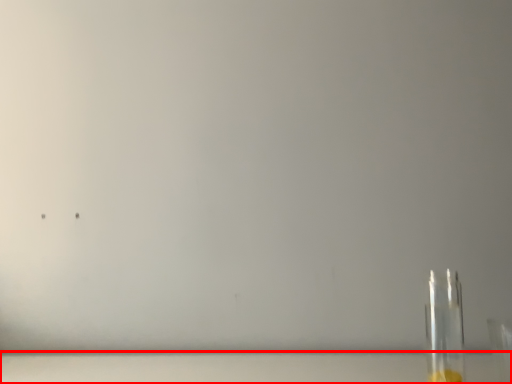
Question: Where is table top (annotated by the red box) located in relation to bottle in the image?

Choices:
 (A) left
 (B) right

Answer: (A)